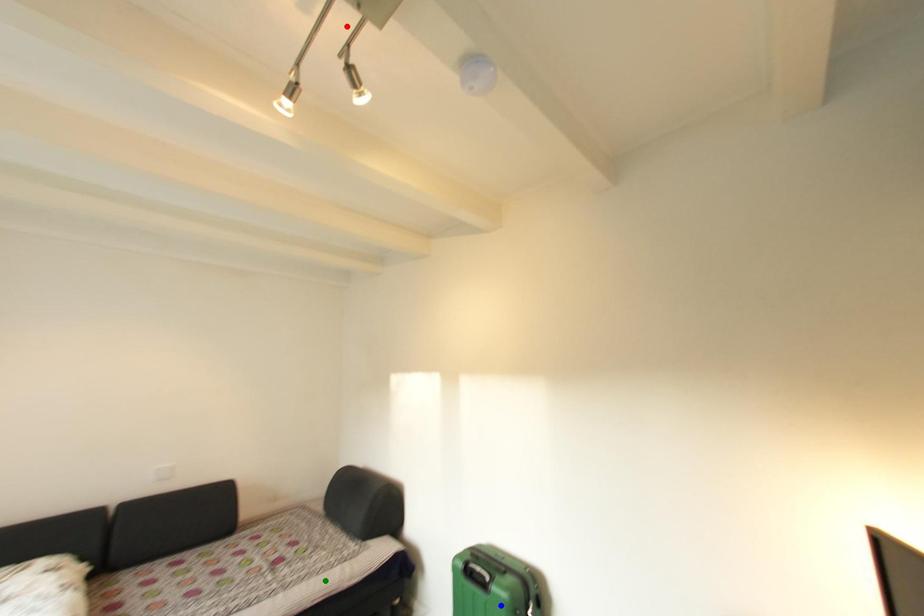
Looking at this image, order these from nearest to farthest:
A) red point
B) blue point
C) green point

1. red point
2. blue point
3. green point